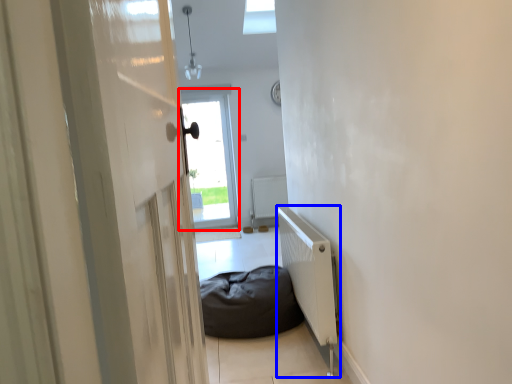
Question: Which object is closer to the camera taking this photo, window (highlighted by a red box) or radiator (highlighted by a blue box)?

Choices:
 (A) window
 (B) radiator

Answer: (B)